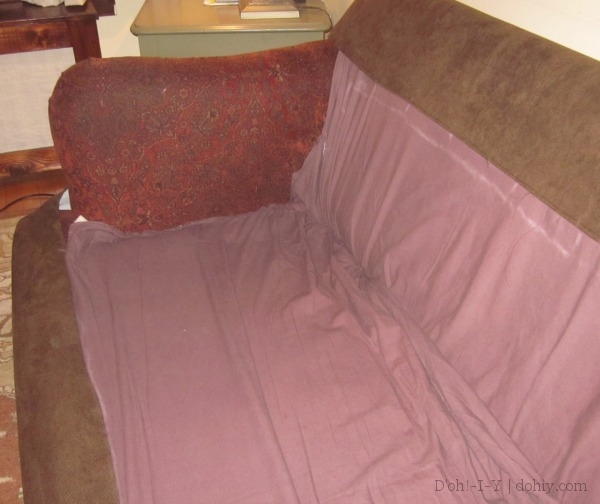
Locate an element on the screen. white wall is located at coordinates (34, 78), (120, 40), (565, 14).